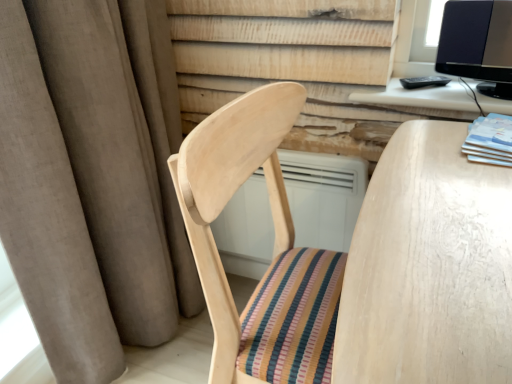
At what (x,y) coordinates should I click in order to perform the action: click on vacant space that is to the left of black glossy monitor at upper right. Please return your answer as a coordinate pair (x, y). The width and height of the screenshot is (512, 384). Looking at the image, I should click on (407, 91).